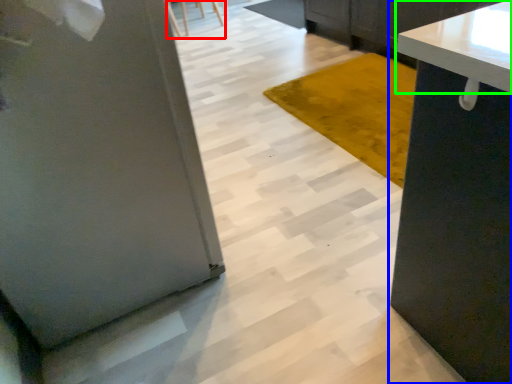
Question: Estimate the real-world distances between objects in this image. Which object is farther from chair (highlighted by a red box), cabinetry (highlighted by a blue box) or countertop (highlighted by a green box)?

Choices:
 (A) cabinetry
 (B) countertop

Answer: (A)